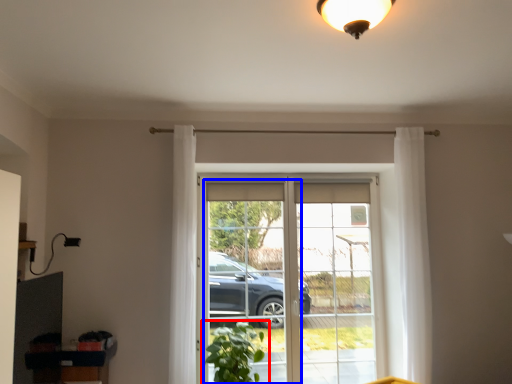
Question: Which of the following is the closest to the observer, houseplant (highlighted by a red box) or screen door (highlighted by a blue box)?

Choices:
 (A) houseplant
 (B) screen door

Answer: (A)